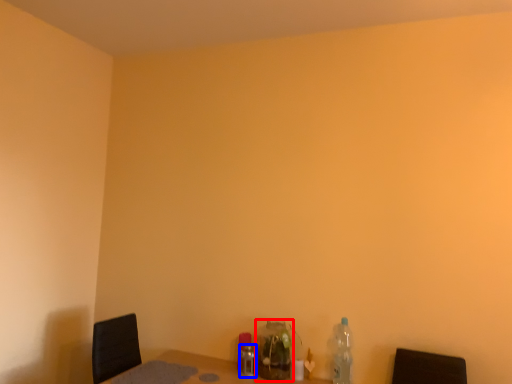
Question: Which object is further to the camera taking this photo, bottle (highlighted by a red box) or bottle (highlighted by a blue box)?

Choices:
 (A) bottle
 (B) bottle

Answer: (B)